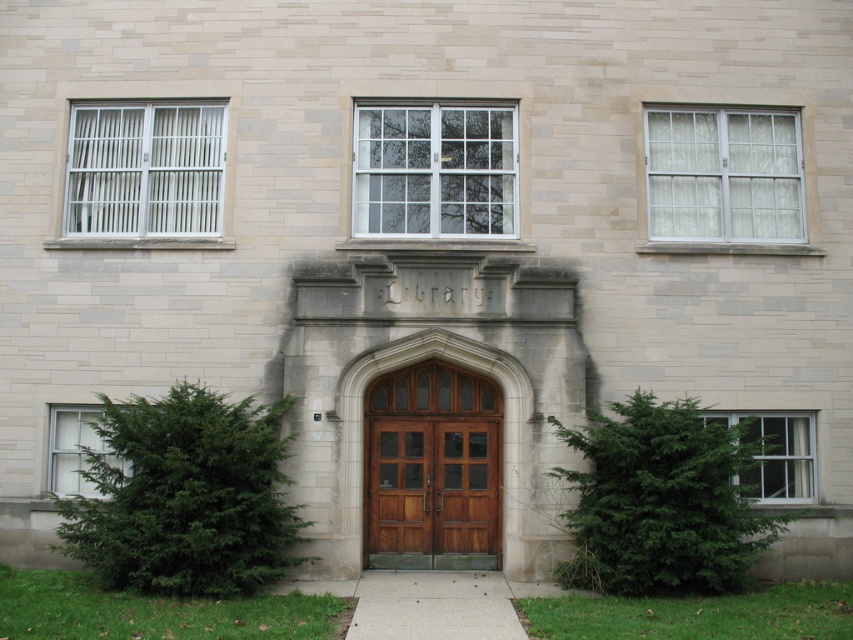
You are a delivery person with a package that requires a 12 feet clearance to pass through. You are standing in front of the library entrance and need to move the package from the polished wood door at center to the white glass window at lower right. Can the package fit through the space between them?

The distance between the polished wood door at center and the white glass window at lower right is 10.03 feet, which is less than the required 12 feet clearance. Therefore, the package cannot fit through the space between them.

You are standing in front of the library building. You need to enter the building through the polished wood door at center. However, you also want to check the white glass window at lower right to see if there is a notice. Which object should you approach first to reach the one you need to enter?

The polished wood door at center is closer to you than the white glass window at lower right, so you should approach the polished wood door at center first to enter the building.